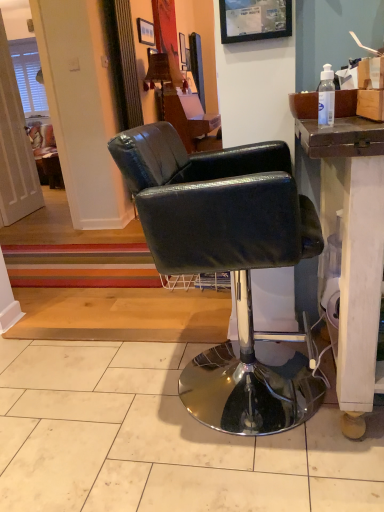
In order to click on vacant space situated on the left part of black leather chair at center in this screenshot , I will do `click(94, 400)`.